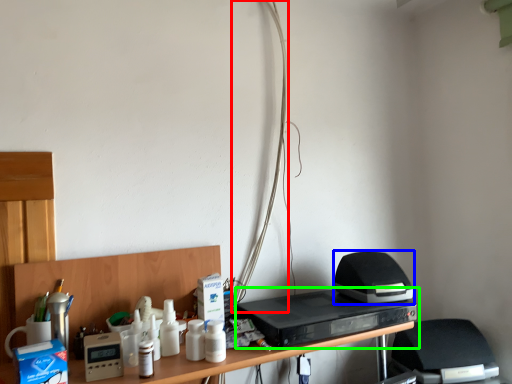
Question: Based on their relative distances, which object is farther from wire (highlighted by a red box)? Choose from appliance (highlighted by a blue box) and home appliance (highlighted by a green box).

Choices:
 (A) appliance
 (B) home appliance

Answer: (A)